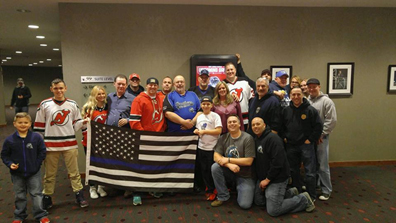
In order to click on floor in this screenshot , I will do `click(382, 205)`.